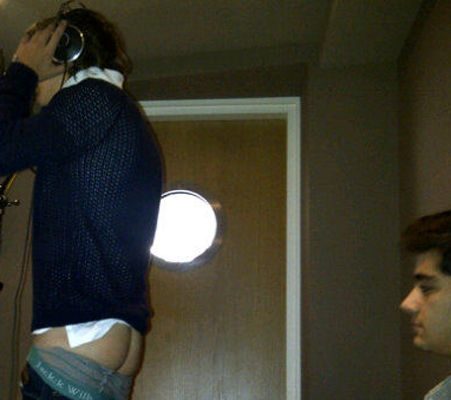
Identify the location of white door frame. The width and height of the screenshot is (451, 400). (293, 297).